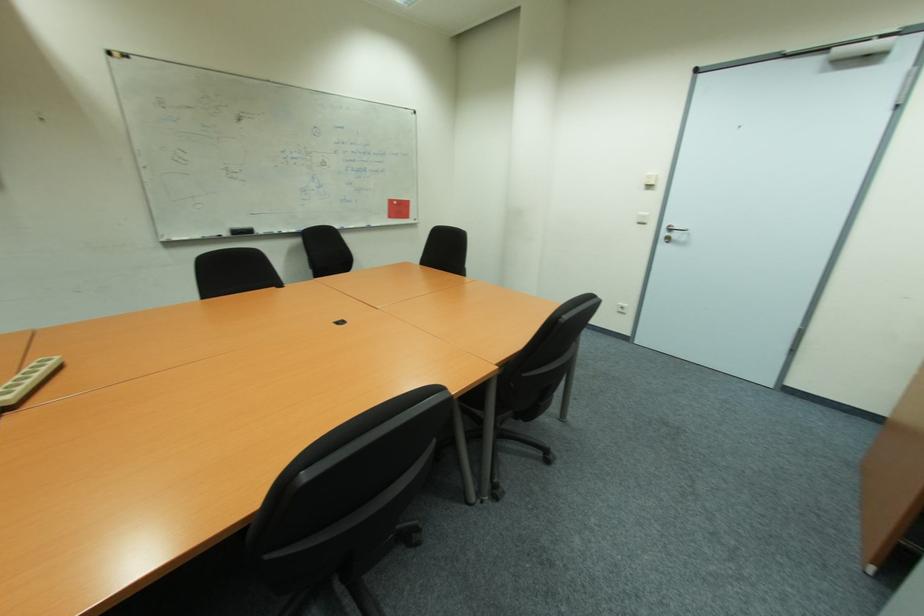
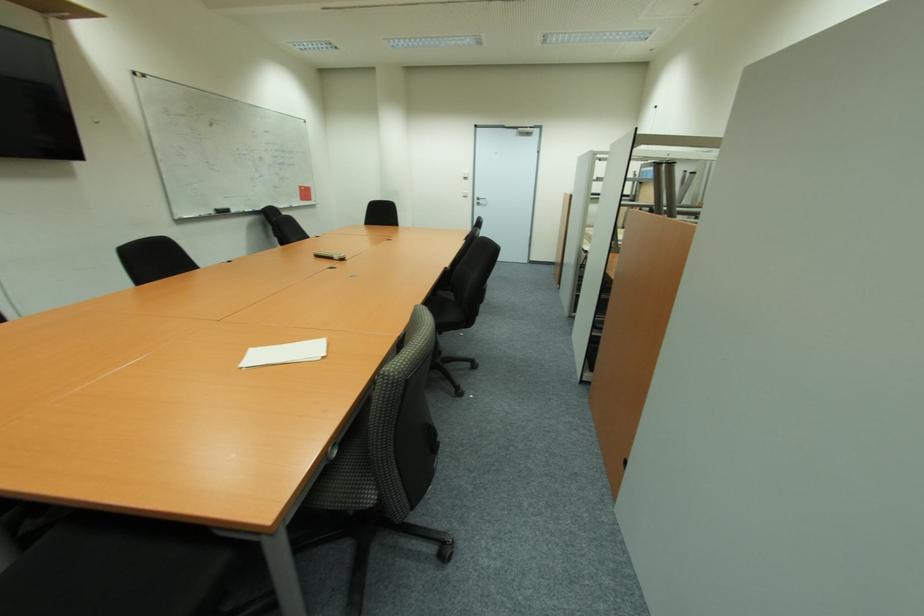
Where in the second image is the point corresponding to (677,236) from the first image?

(483, 203)